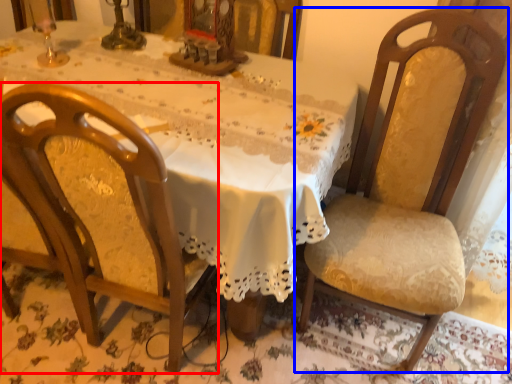
Question: Which object is closer to the camera taking this photo, chair (highlighted by a red box) or chair (highlighted by a blue box)?

Choices:
 (A) chair
 (B) chair

Answer: (A)